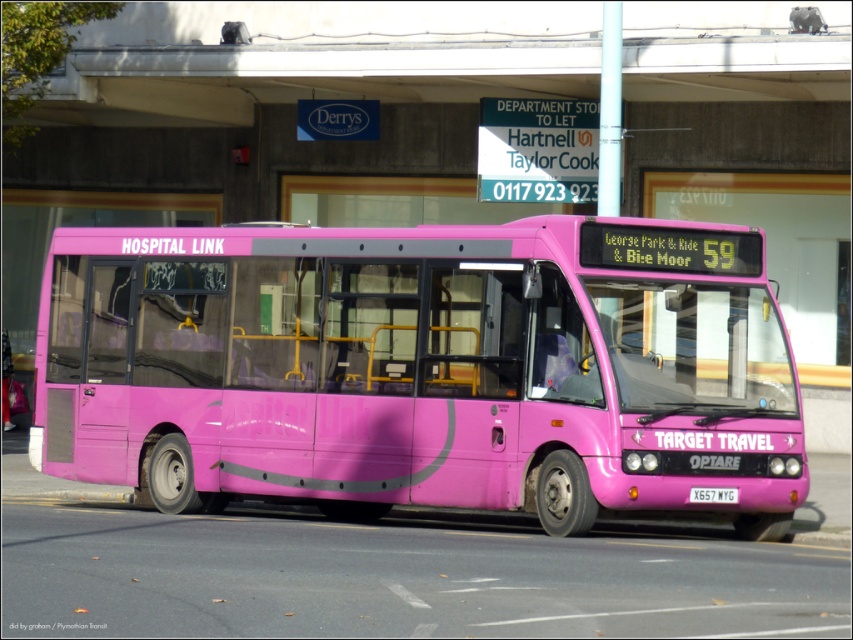
Does matte pink bus at center appear under white plastic license plate at center?

Incorrect, matte pink bus at center is not positioned below white plastic license plate at center.

Is point (204, 330) behind point (709, 490)?

That is True.

At what (x,y) coordinates should I click in order to perform the action: click on matte pink bus at center. Please return your answer as a coordinate pair (x, y). Looking at the image, I should click on (422, 369).